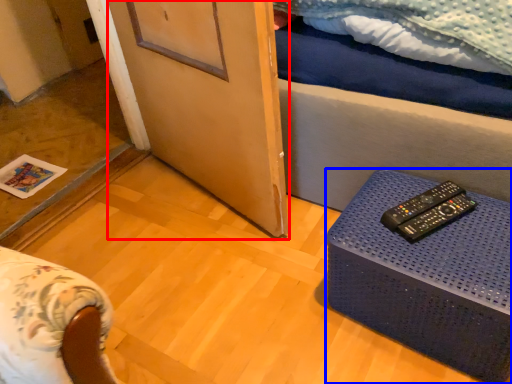
Question: Among these objects, which one is farthest to the camera, screen door (highlighted by a red box) or table (highlighted by a blue box)?

Choices:
 (A) screen door
 (B) table

Answer: (A)